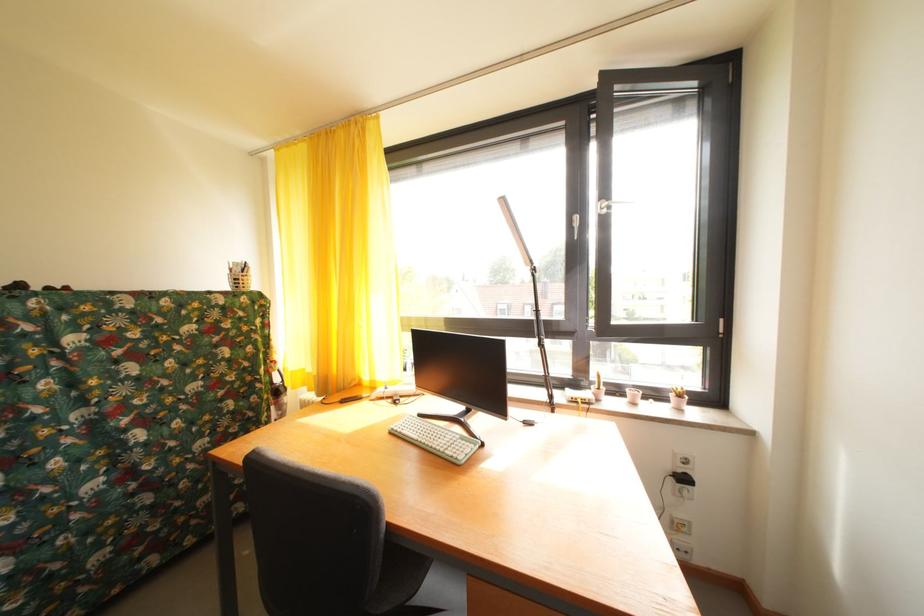
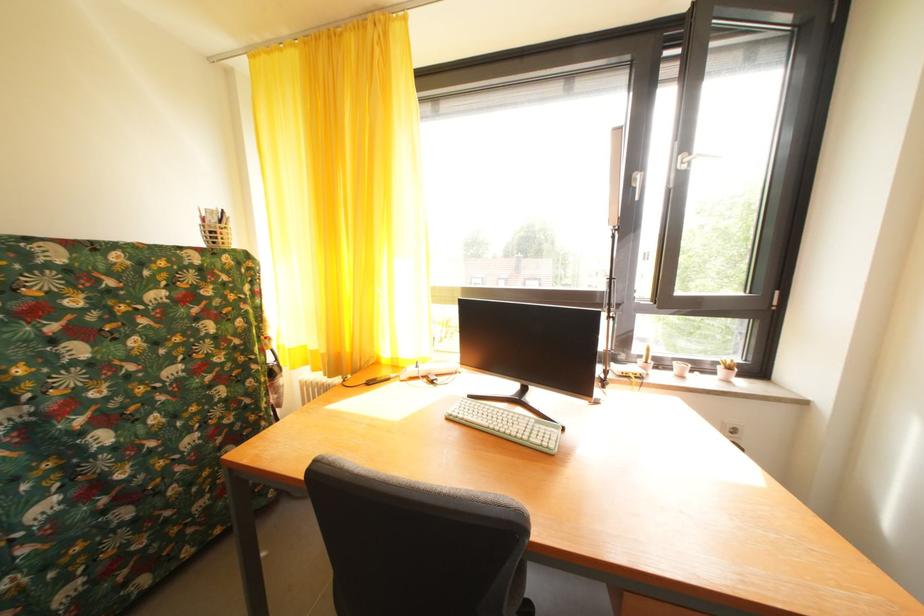
Question: The camera is either moving clockwise (left) or counter-clockwise (right) around the object. The first image is from the beginning of the video and the second image is from the end. Is the camera moving left or right when shooting the video?

Choices:
 (A) Left
 (B) Right

Answer: (A)